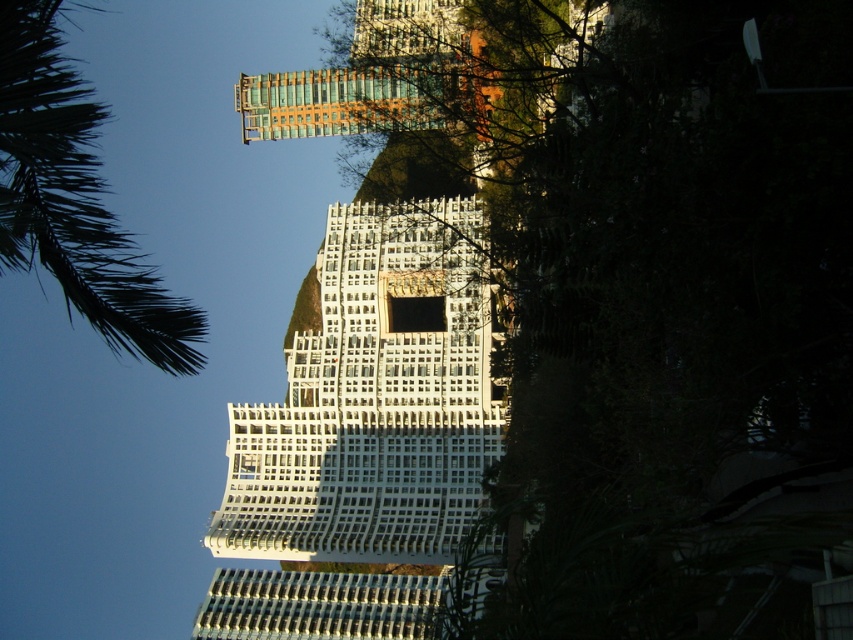
Who is taller, white glass building at center or green leafy palm tree at upper left?

With more height is green leafy palm tree at upper left.

Which is more to the left, white glass building at center or green leafy palm tree at upper left?

Positioned to the left is green leafy palm tree at upper left.

This screenshot has height=640, width=853. What are the coordinates of `white glass building at center` in the screenshot? It's located at (374, 400).

Does green leafy tree at center come in front of white glass building at center?

That is True.

Locate an element on the screen. Image resolution: width=853 pixels, height=640 pixels. green leafy tree at center is located at coordinates (668, 317).

Which is in front, point (798, 488) or point (45, 80)?

Point (45, 80) is in front.

Is green leafy tree at center shorter than green leafy palm tree at upper left?

In fact, green leafy tree at center may be taller than green leafy palm tree at upper left.

Who is more forward, [523,573] or [143,256]?

Point [523,573] is in front.

Locate an element on the screen. Image resolution: width=853 pixels, height=640 pixels. green leafy tree at center is located at coordinates (668, 317).